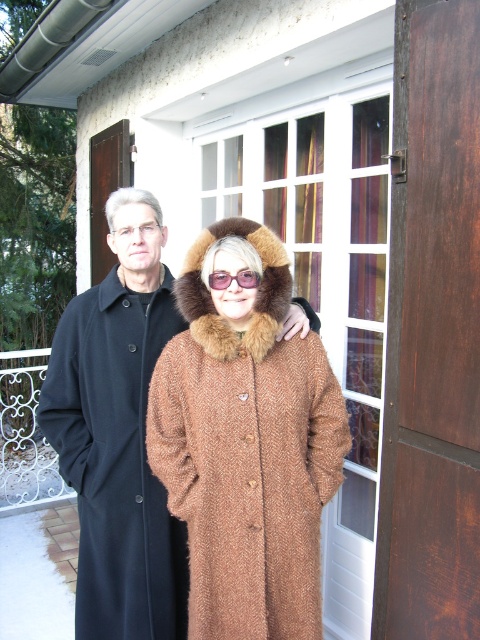
Question: In this image, where is brown wool coat at center located relative to black wool coat at left?

Choices:
 (A) above
 (B) below

Answer: (A)

Question: Among these points, which one is nearest to the camera?

Choices:
 (A) (257, 456)
 (B) (154, 579)
 (C) (250, 272)

Answer: (A)

Question: Which is farther from the brown wool coat at center?

Choices:
 (A) pink plastic goggles at center
 (B) black wool coat at left

Answer: (A)

Question: Is brown wool coat at center positioned in front of pink plastic goggles at center?

Choices:
 (A) yes
 (B) no

Answer: (A)

Question: In this image, where is brown wool coat at center located relative to pink plastic goggles at center?

Choices:
 (A) below
 (B) above

Answer: (A)

Question: Which is farther from the brown wool coat at center?

Choices:
 (A) black wool coat at left
 (B) pink plastic goggles at center

Answer: (B)